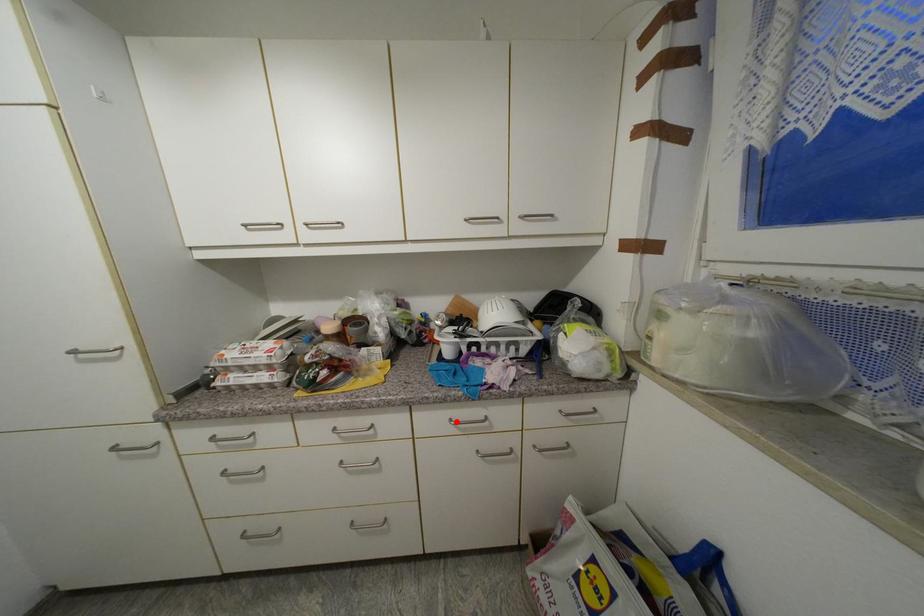
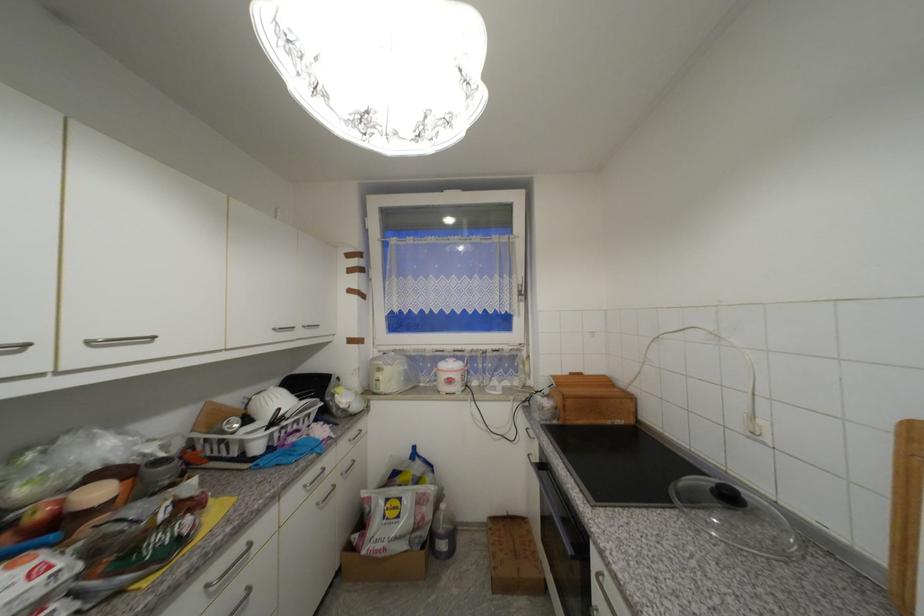
Where in the second image is the point corresponding to the highlighted location from the first image?

(310, 488)